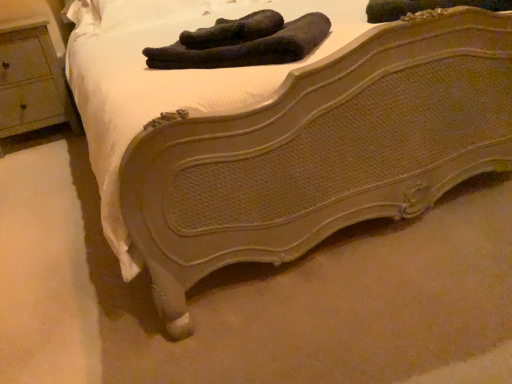
Question: Considering the relative positions of black fuzzy socks at center, the first footwear when ordered from right to left, and wooden nightstand at left in the image provided, is black fuzzy socks at center, the first footwear when ordered from right to left, in front of wooden nightstand at left?

Choices:
 (A) yes
 (B) no

Answer: (A)

Question: From the image's perspective, is black fuzzy socks at center, the first footwear when ordered from right to left, beneath wooden nightstand at left?

Choices:
 (A) yes
 (B) no

Answer: (A)

Question: Does black fuzzy socks at center, the first footwear when ordered from right to left, have a smaller size compared to wooden nightstand at left?

Choices:
 (A) yes
 (B) no

Answer: (A)

Question: Can you confirm if black fuzzy socks at center, the first footwear when ordered from right to left, is shorter than wooden nightstand at left?

Choices:
 (A) no
 (B) yes

Answer: (B)

Question: Can you confirm if black fuzzy socks at center, placed as the second footwear when sorted from left to right, is wider than wooden nightstand at left?

Choices:
 (A) yes
 (B) no

Answer: (B)

Question: Is wooden nightstand at left to the left or to the right of dark green fabric socks at upper center, the 1th footwear from the left, in the image?

Choices:
 (A) right
 (B) left

Answer: (B)

Question: From a real-world perspective, relative to dark green fabric socks at upper center, which is the second footwear from right to left, is wooden nightstand at left vertically above or below?

Choices:
 (A) above
 (B) below

Answer: (B)

Question: Considering the positions of wooden nightstand at left and dark green fabric socks at upper center, the 1th footwear from the left, in the image, is wooden nightstand at left bigger or smaller than dark green fabric socks at upper center, the 1th footwear from the left,?

Choices:
 (A) small
 (B) big

Answer: (B)

Question: Would you say wooden nightstand at left is inside or outside dark green fabric socks at upper center, the 1th footwear from the left?

Choices:
 (A) inside
 (B) outside

Answer: (B)

Question: Is dark green fabric socks at upper center, the 1th footwear from the left, bigger or smaller than wooden nightstand at left?

Choices:
 (A) small
 (B) big

Answer: (A)

Question: Considering the positions of dark green fabric socks at upper center, which is the second footwear from right to left, and wooden nightstand at left in the image, is dark green fabric socks at upper center, which is the second footwear from right to left, wider or thinner than wooden nightstand at left?

Choices:
 (A) wide
 (B) thin

Answer: (B)

Question: From a real-world perspective, is dark green fabric socks at upper center, the 1th footwear from the left, above or below wooden nightstand at left?

Choices:
 (A) below
 (B) above

Answer: (B)

Question: Based on their positions, is dark green fabric socks at upper center, the 1th footwear from the left, located to the left or right of wooden nightstand at left?

Choices:
 (A) right
 (B) left

Answer: (A)

Question: From a real-world perspective, is black fuzzy socks at center, placed as the second footwear when sorted from left to right, physically located above or below wooden nightstand at left?

Choices:
 (A) below
 (B) above

Answer: (B)

Question: From the image's perspective, relative to wooden nightstand at left, is black fuzzy socks at center, placed as the second footwear when sorted from left to right, above or below?

Choices:
 (A) below
 (B) above

Answer: (A)